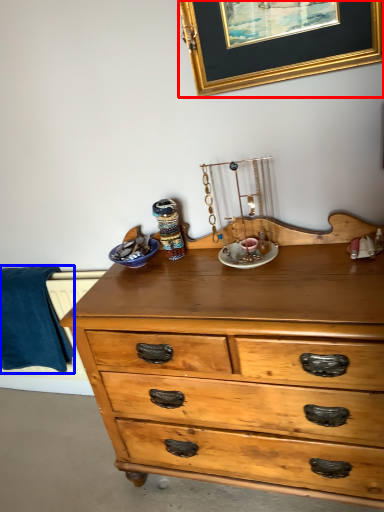
Question: Which of the following is the closest to the observer, picture frame (highlighted by a red box) or blanket (highlighted by a blue box)?

Choices:
 (A) picture frame
 (B) blanket

Answer: (A)